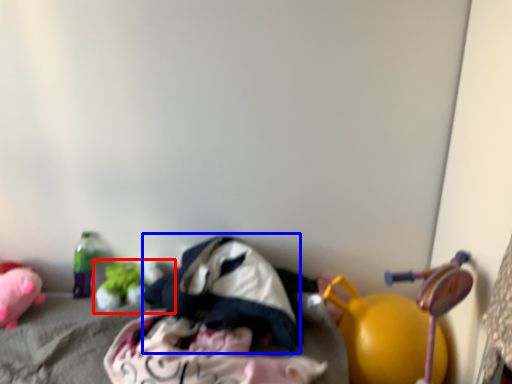
Question: Which object appears farthest to the camera in this image, toy (highlighted by a red box) or clothing (highlighted by a blue box)?

Choices:
 (A) toy
 (B) clothing

Answer: (A)